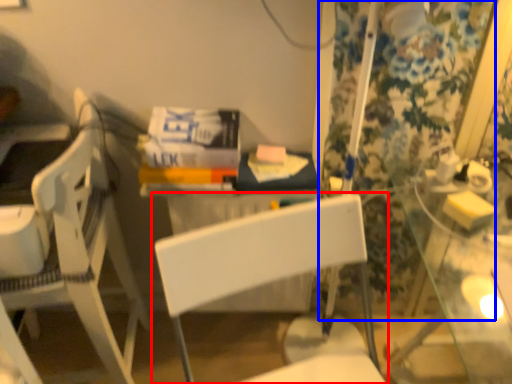
Question: Which object appears closest to the camera in this image, chair (highlighted by a red box) or curtain (highlighted by a blue box)?

Choices:
 (A) chair
 (B) curtain

Answer: (A)